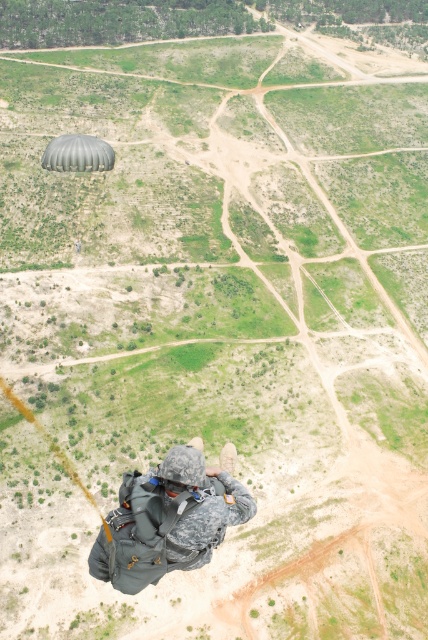
Question: Which of the following is the closest to the observer?

Choices:
 (A) (100, 148)
 (B) (115, 572)

Answer: (B)

Question: Can you confirm if camouflage fabric helmet at center is wider than green matte parachute at upper center?

Choices:
 (A) yes
 (B) no

Answer: (B)

Question: Does camouflage fabric helmet at center have a smaller size compared to green matte parachute at upper center?

Choices:
 (A) no
 (B) yes

Answer: (B)

Question: Is camouflage fabric helmet at center smaller than green matte parachute at upper center?

Choices:
 (A) yes
 (B) no

Answer: (A)